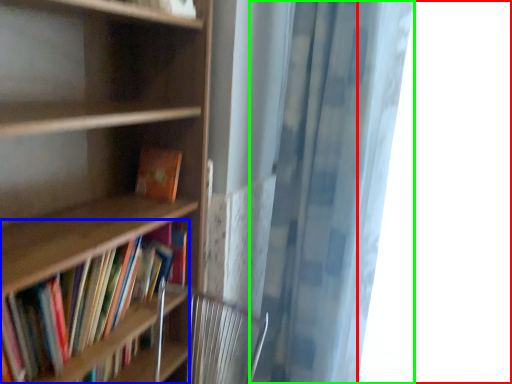
Question: Based on their relative distances, which object is farther from window (highlighted by a red box)? Choose from book (highlighted by a blue box) and shower curtain (highlighted by a green box).

Choices:
 (A) book
 (B) shower curtain

Answer: (A)